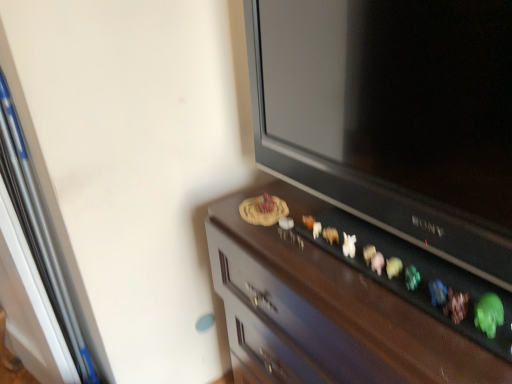
This screenshot has width=512, height=384. I want to click on free point above wooden cabinet at center (from a real-world perspective), so click(335, 259).